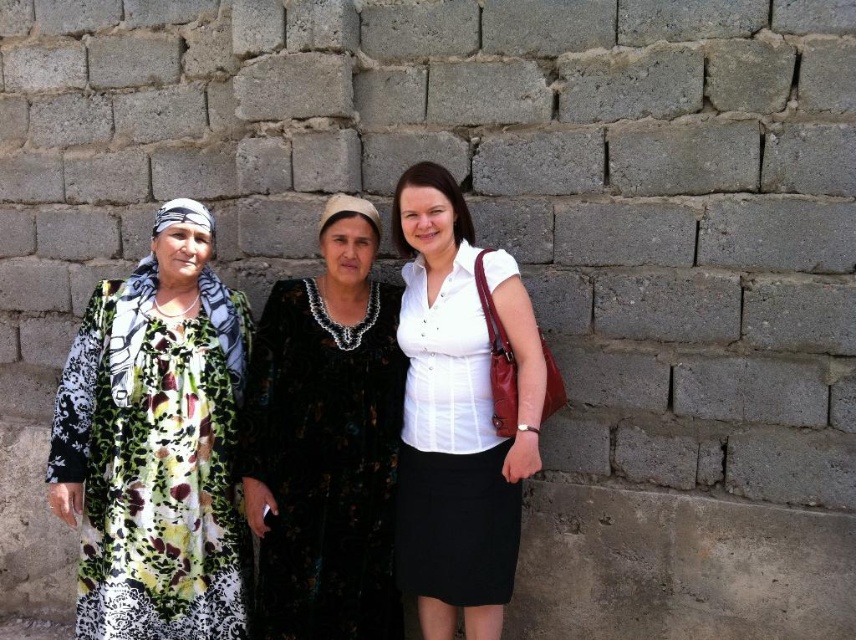
Looking at this image, does floral-patterned dress at left have a smaller size compared to white matte shirt at center?

Yes.

Does floral-patterned dress at left appear over white matte shirt at center?

No.

Does point (153, 534) lie in front of point (489, 256)?

No, (153, 534) is further to viewer.

Identify the location of floral-patterned dress at left. The image size is (856, 640). (155, 444).

Measure the distance from black floral dress at center to white matte shirt at center.

A distance of 10.51 inches exists between black floral dress at center and white matte shirt at center.

Does black floral dress at center appear over white matte shirt at center?

Actually, black floral dress at center is below white matte shirt at center.

This screenshot has width=856, height=640. What do you see at coordinates (325, 442) in the screenshot?
I see `black floral dress at center` at bounding box center [325, 442].

At what (x,y) coordinates should I click in order to perform the action: click on black floral dress at center. Please return your answer as a coordinate pair (x, y). Image resolution: width=856 pixels, height=640 pixels. Looking at the image, I should click on (325, 442).

Which is in front, point (153, 621) or point (266, 328)?

Point (153, 621)

Is floral-patterned dress at left wider than black floral dress at center?

Yes, floral-patterned dress at left is wider than black floral dress at center.

Where is `floral-patterned dress at left`? The height and width of the screenshot is (640, 856). floral-patterned dress at left is located at coordinates (155, 444).